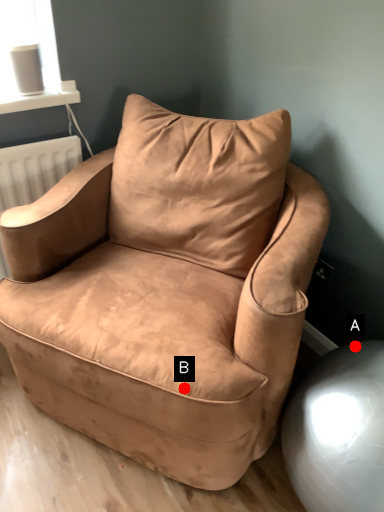
Question: Two points are circled on the image, labeled by A and B beside each circle. Which point is closer to the camera taking this photo?

Choices:
 (A) A is closer
 (B) B is closer

Answer: (B)